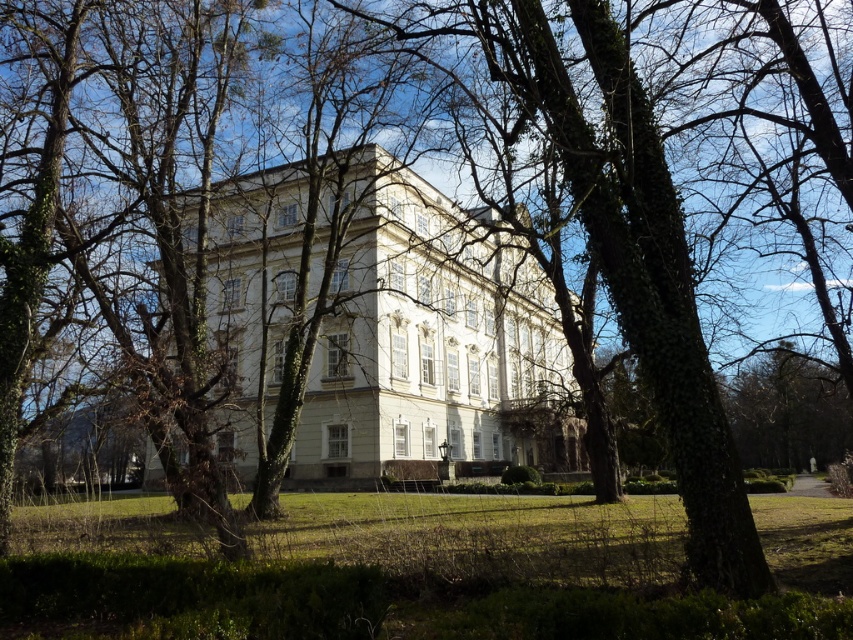
You are standing in front of the grand building and notice two points marked on the lawn. The first point is at coordinates point (x=408, y=618) and the second is at point (x=425, y=284). Which point is closer to you?

Point (x=408, y=618) is closer to the viewer than point (x=425, y=284).